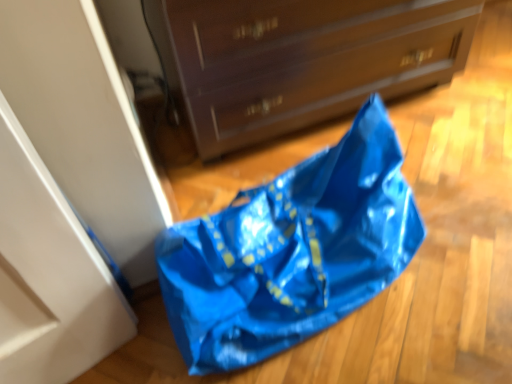
Identify the location of vacant area that lies to the right of blue plastic bag at lower center. (457, 213).